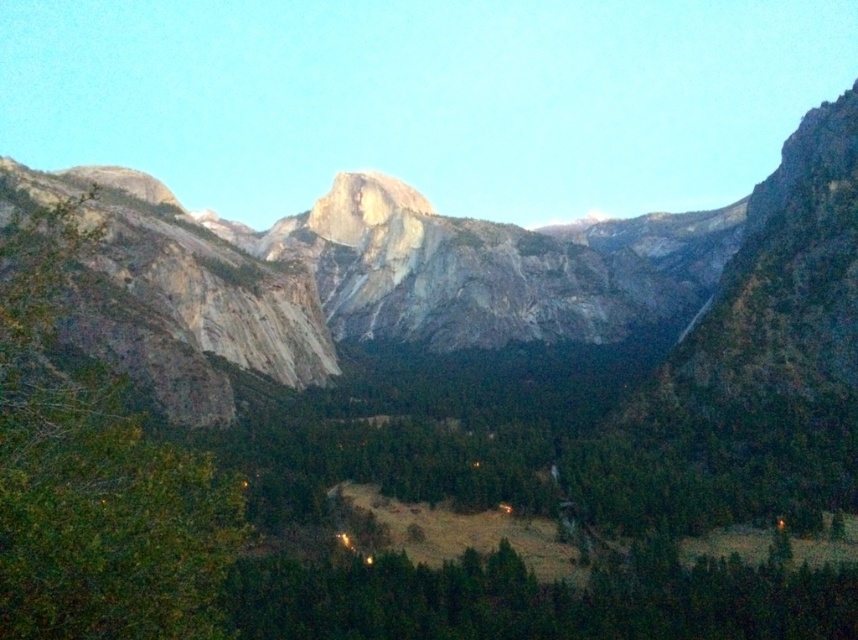
Does green leafy tree at left have a lesser height compared to green matte tree at lower center?

In fact, green leafy tree at left may be taller than green matte tree at lower center.

Which is above, green leafy tree at left or green matte tree at lower center?

green leafy tree at left is above.

Does point (61, 282) come farther from viewer compared to point (573, 596)?

Yes, point (61, 282) is behind point (573, 596).

Locate an element on the screen. The width and height of the screenshot is (858, 640). green leafy tree at left is located at coordinates (94, 476).